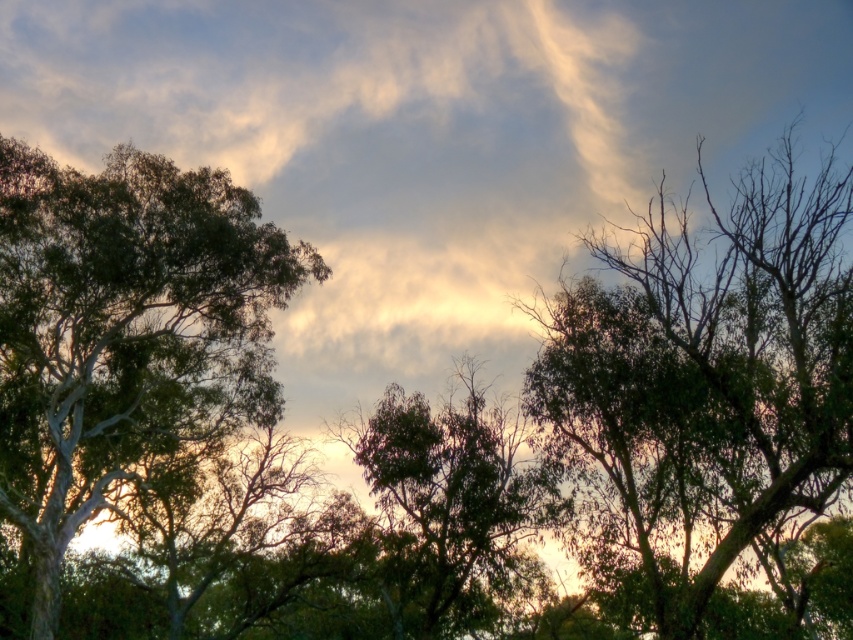
Is green leafy tree at right taller than green leafy tree at upper left?

No, green leafy tree at right is not taller than green leafy tree at upper left.

Between point (555, 328) and point (119, 170), which one is positioned behind?

Positioned behind is point (119, 170).

Between point (751, 278) and point (114, 211), which one is positioned behind?

Positioned behind is point (114, 211).

This screenshot has height=640, width=853. I want to click on green leafy tree at right, so click(x=709, y=376).

Does green leafy tree at right have a lesser height compared to green leafy tree at center?

In fact, green leafy tree at right may be taller than green leafy tree at center.

Is point (566, 394) closer to viewer compared to point (474, 388)?

Yes, point (566, 394) is in front of point (474, 388).

Identify the location of green leafy tree at right. The width and height of the screenshot is (853, 640). (709, 376).

Does green leafy tree at upper left appear under green leafy tree at center?

Actually, green leafy tree at upper left is above green leafy tree at center.

Which is above, green leafy tree at upper left or green leafy tree at center?

green leafy tree at upper left is higher up.

The image size is (853, 640). Identify the location of green leafy tree at upper left. (125, 332).